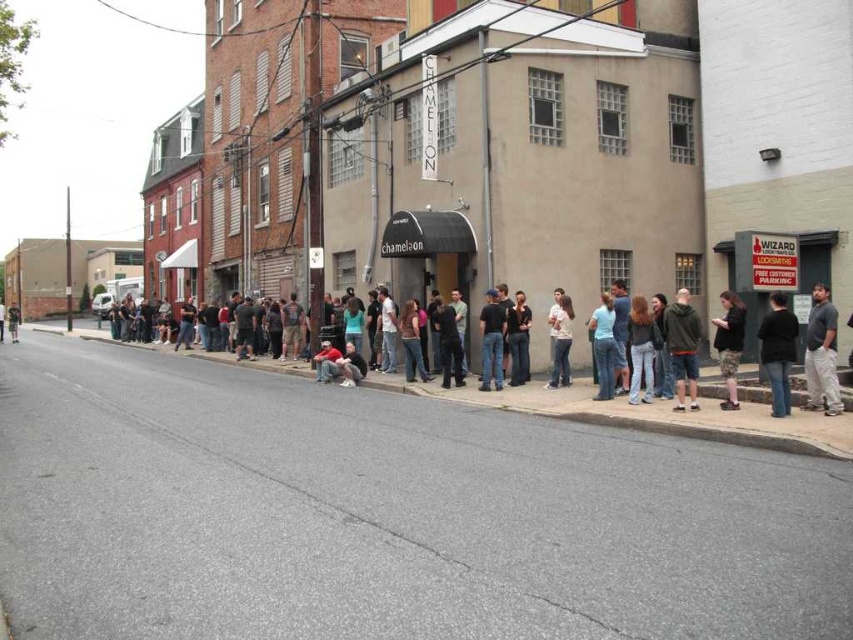
At what (x,y) coordinates should I click in order to perform the action: click on gray concrete curb at lower center. Please return your answer as a coordinate pair (x, y). Looking at the image, I should click on (654, 416).

Who is lower down, gray concrete curb at lower center or black jeans at center?

gray concrete curb at lower center

Image resolution: width=853 pixels, height=640 pixels. I want to click on gray concrete curb at lower center, so pos(654,416).

Locate an element on the screen. Image resolution: width=853 pixels, height=640 pixels. gray concrete curb at lower center is located at coordinates (654, 416).

Is gray concrete curb at lower center closer to camera compared to light blue denim jeans at center?

Yes.

Does gray concrete curb at lower center appear under light blue denim jeans at center?

Correct, gray concrete curb at lower center is located below light blue denim jeans at center.

Is point (460, 403) behind point (608, 305)?

That is True.

You are a GUI agent. You are given a task and a screenshot of the screen. Output one action in this format:
    pyautogui.click(x=<x>, y=<y>)
    Task: Click on the gray concrete curb at lower center
    Image resolution: width=853 pixels, height=640 pixels.
    Given the screenshot: What is the action you would take?
    pyautogui.click(x=654, y=416)

In the scene shown: Who is positioned more to the left, denim jacket at center or camouflage pants at center?

Positioned to the left is camouflage pants at center.

In order to click on denim jacket at center in this screenshot , I will do (x=641, y=349).

Find the location of a particular element. The height and width of the screenshot is (640, 853). denim jacket at center is located at coordinates (641, 349).